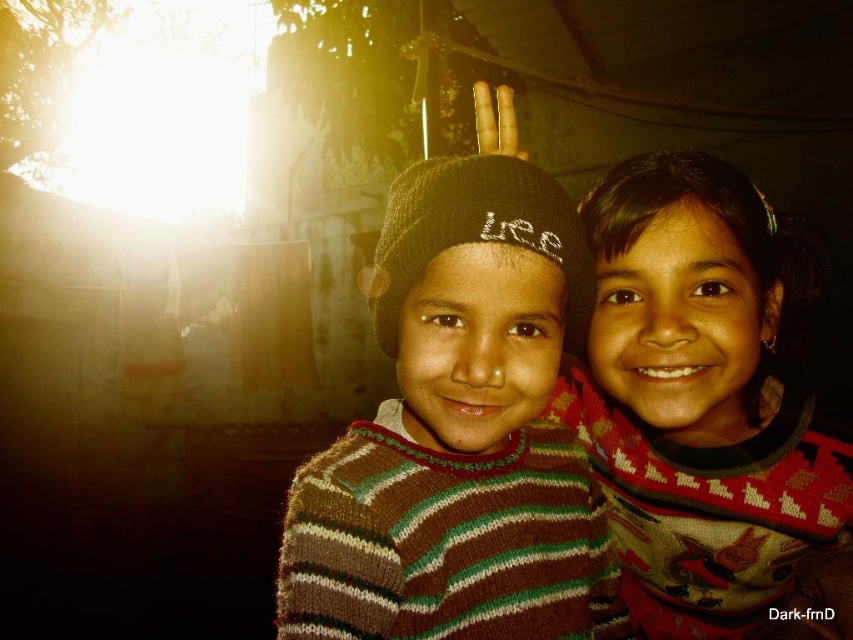
Question: Is knitted striped sweater at center positioned before knitted sweater at center?

Choices:
 (A) yes
 (B) no

Answer: (A)

Question: Considering the relative positions of knitted striped sweater at center and knitted sweater at center in the image provided, where is knitted striped sweater at center located with respect to knitted sweater at center?

Choices:
 (A) left
 (B) right

Answer: (A)

Question: Which point appears closest to the camera in this image?

Choices:
 (A) (509, 182)
 (B) (724, 584)

Answer: (A)

Question: Which of the following is the closest to the observer?

Choices:
 (A) knitted sweater at center
 (B) knitted striped sweater at center

Answer: (B)

Question: Considering the relative positions of knitted striped sweater at center and knitted sweater at center in the image provided, where is knitted striped sweater at center located with respect to knitted sweater at center?

Choices:
 (A) below
 (B) above

Answer: (A)